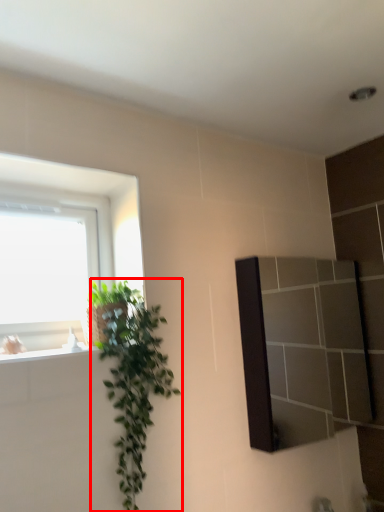
Question: Where is houseplant (annotated by the red box) located in relation to mirror in the image?

Choices:
 (A) left
 (B) right

Answer: (A)